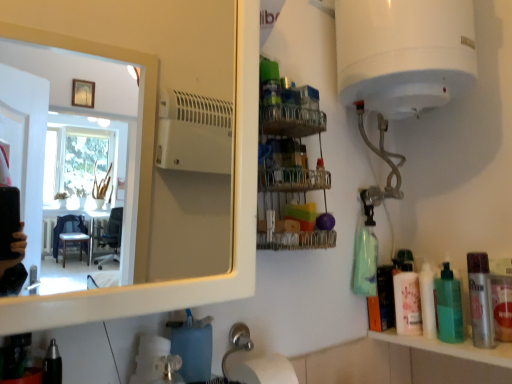
Question: Would you consider green translucent bottle at right, which appears as the 2th mouthwash when viewed from the front, to be distant from silver metallic mouthwash at right, the 2th mouthwash positioned from the back?

Choices:
 (A) yes
 (B) no

Answer: (B)

Question: From the image's perspective, is green translucent bottle at right, which appears as the 2th mouthwash when viewed from the front, beneath silver metallic mouthwash at right, which appears as the 1th mouthwash when viewed from the front?

Choices:
 (A) yes
 (B) no

Answer: (A)

Question: From a real-world perspective, is green translucent bottle at right, placed as the first mouthwash when sorted from back to front, on top of silver metallic mouthwash at right, the 2th mouthwash positioned from the back?

Choices:
 (A) no
 (B) yes

Answer: (B)

Question: Is green translucent bottle at right, which appears as the 2th mouthwash when viewed from the front, located outside silver metallic mouthwash at right, which appears as the 1th mouthwash when viewed from the front?

Choices:
 (A) no
 (B) yes

Answer: (B)

Question: Is the depth of green translucent bottle at right, which appears as the 2th mouthwash when viewed from the front, greater than that of silver metallic mouthwash at right, the 2th mouthwash positioned from the back?

Choices:
 (A) yes
 (B) no

Answer: (A)

Question: Is matte white bottle at right wider or thinner than white glossy mirror at upper left?

Choices:
 (A) wide
 (B) thin

Answer: (B)

Question: From a real-world perspective, is matte white bottle at right positioned above or below white glossy mirror at upper left?

Choices:
 (A) above
 (B) below

Answer: (B)

Question: Considering the relative positions of matte white bottle at right and white glossy mirror at upper left in the image provided, is matte white bottle at right to the left or to the right of white glossy mirror at upper left?

Choices:
 (A) right
 (B) left

Answer: (A)

Question: From the image's perspective, is matte white bottle at right above or below white glossy mirror at upper left?

Choices:
 (A) below
 (B) above

Answer: (A)

Question: Considering the positions of matte white bottle at right and metallic wire rack at upper center in the image, is matte white bottle at right wider or thinner than metallic wire rack at upper center?

Choices:
 (A) thin
 (B) wide

Answer: (A)

Question: Considering the positions of matte white bottle at right and metallic wire rack at upper center in the image, is matte white bottle at right bigger or smaller than metallic wire rack at upper center?

Choices:
 (A) big
 (B) small

Answer: (B)

Question: Would you say matte white bottle at right is inside or outside metallic wire rack at upper center?

Choices:
 (A) inside
 (B) outside

Answer: (B)

Question: From the image's perspective, is matte white bottle at right positioned above or below metallic wire rack at upper center?

Choices:
 (A) above
 (B) below

Answer: (B)

Question: Is matte white bottle at right inside the boundaries of green translucent bottle at right, placed as the first mouthwash when sorted from back to front, or outside?

Choices:
 (A) inside
 (B) outside

Answer: (B)

Question: From a real-world perspective, is matte white bottle at right physically located above or below green translucent bottle at right, which appears as the 2th mouthwash when viewed from the front?

Choices:
 (A) above
 (B) below

Answer: (B)